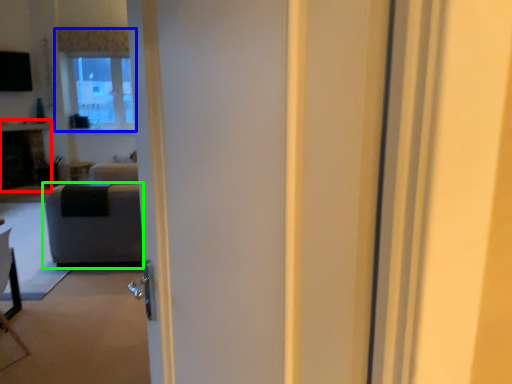
Question: Considering the real-world distances, which object is farthest from fireplace (highlighted by a red box)? window (highlighted by a blue box) or furniture (highlighted by a green box)?

Choices:
 (A) window
 (B) furniture

Answer: (B)